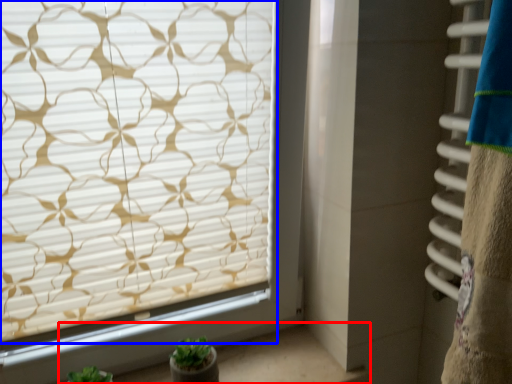
Question: Which point is further to the camera, window sill (highlighted by a red box) or window blind (highlighted by a blue box)?

Choices:
 (A) window sill
 (B) window blind

Answer: (A)